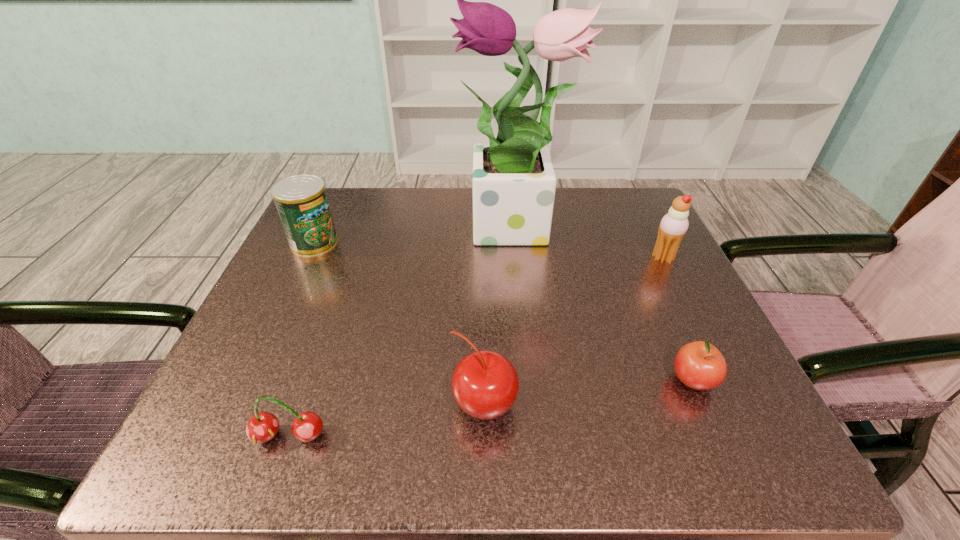
Locate an element on the screen. This screenshot has width=960, height=540. the tallest object is located at coordinates (514, 182).

In order to click on icecream in this screenshot , I will do `click(673, 226)`.

I want to click on can, so click(x=301, y=200).

At what (x,y) coordinates should I click in order to perform the action: click on the taller cherry. Please return your answer as a coordinate pair (x, y). Image resolution: width=960 pixels, height=540 pixels. Looking at the image, I should click on (485, 384).

At what (x,y) coordinates should I click in order to perform the action: click on the fourth tallest object. Please return your answer as a coordinate pair (x, y). The image size is (960, 540). Looking at the image, I should click on (485, 384).

Locate an element on the screen. This screenshot has width=960, height=540. the shorter cherry is located at coordinates tap(262, 427).

I want to click on apple, so click(699, 365).

Where is `vacant space located on the front-facing side of the flower arrangement`? Image resolution: width=960 pixels, height=540 pixels. vacant space located on the front-facing side of the flower arrangement is located at coordinates (369, 230).

Locate an element on the screen. The image size is (960, 540). vacant space situated 0.200m on the front-facing side of the flower arrangement is located at coordinates (369, 230).

Locate an element on the screen. This screenshot has height=540, width=960. vacant area located on the front-facing side of the flower arrangement is located at coordinates (333, 230).